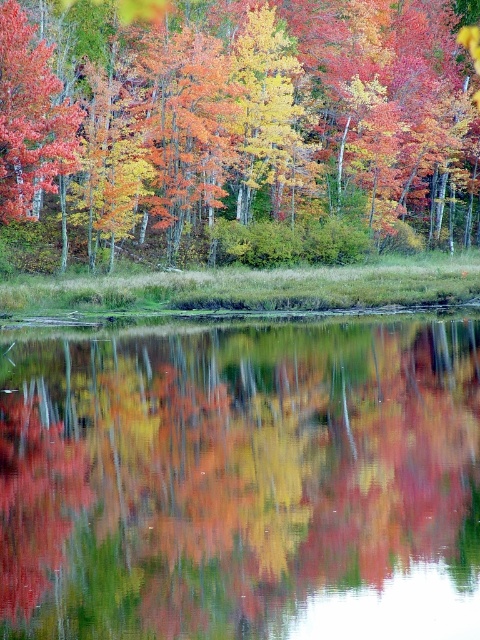
You are an artist planning to paint the autumn scene. You want to ensure the transparent glass water at center and autumn leaves at center are proportionally accurate. Which object should you paint first to maintain the correct size relationship between them?

You should paint the autumn leaves at center first since the transparent glass water at center occupies less space, meaning it should be smaller in your painting. By starting with the larger autumn leaves at center, you can then accurately size the smaller transparent glass water at center in relation to it.